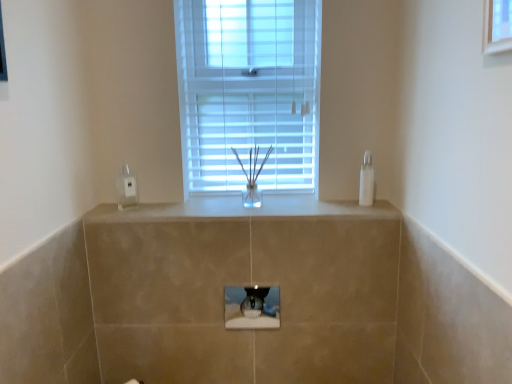
Question: Is clear plastic electric outlet at left taller or shorter than transparent plastic soap dispenser at right?

Choices:
 (A) tall
 (B) short

Answer: (B)

Question: From the image's perspective, is clear plastic electric outlet at left positioned above or below transparent plastic soap dispenser at right?

Choices:
 (A) above
 (B) below

Answer: (B)

Question: Which object is the farthest from the clear plastic electric outlet at left?

Choices:
 (A) white plastic window at center
 (B) white glossy counter top at center
 (C) transparent plastic soap dispenser at right
 (D) transparent glass hole at center

Answer: (C)

Question: Considering the real-world distances, which object is farthest from the white plastic window at center?

Choices:
 (A) transparent glass hole at center
 (B) transparent plastic soap dispenser at right
 (C) white glossy counter top at center
 (D) clear plastic electric outlet at left

Answer: (A)